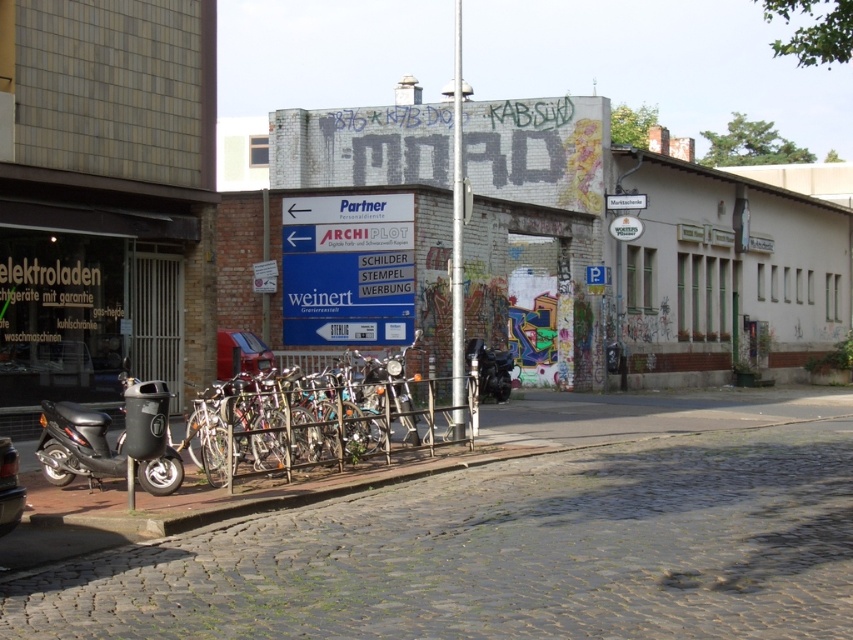
Question: Does shiny metallic bicycles at center come behind matte black scooter at lower left?

Choices:
 (A) no
 (B) yes

Answer: (B)

Question: Which of the following is the farthest from the observer?

Choices:
 (A) shiny chrome motorcycle at center
 (B) shiny metallic bicycles at center

Answer: (A)

Question: Estimate the real-world distances between objects in this image. Which object is farther from the shiny chrome motorcycle at center?

Choices:
 (A) shiny black motorcycle at center
 (B) matte black scooter at lower left
 (C) cobblestone pavement at lower center
 (D) shiny metallic bicycles at center

Answer: (A)

Question: Which of the following is the farthest from the observer?

Choices:
 (A) (308, 384)
 (B) (64, 404)

Answer: (A)

Question: Does cobblestone pavement at lower center have a larger size compared to matte black scooter at lower left?

Choices:
 (A) yes
 (B) no

Answer: (A)

Question: Is matte black scooter at lower left below shiny black motorcycle at center?

Choices:
 (A) yes
 (B) no

Answer: (A)